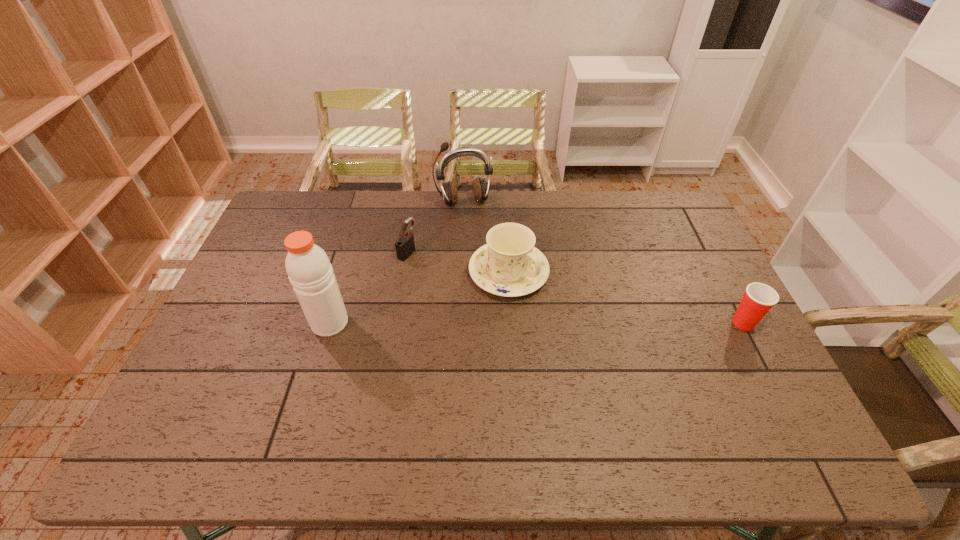
At what (x,y) coordinates should I click in order to perform the action: click on blank space at the far edge. Please return your answer as a coordinate pair (x, y). This screenshot has height=540, width=960. Looking at the image, I should click on (586, 222).

Where is `free region at the near edge`? The image size is (960, 540). free region at the near edge is located at coordinates (573, 387).

The image size is (960, 540). Find the location of `vacant area at the left edge of the desktop`. vacant area at the left edge of the desktop is located at coordinates (251, 379).

This screenshot has width=960, height=540. I want to click on vacant area at the right edge, so click(698, 246).

This screenshot has width=960, height=540. Find the location of `vacant space at the near right corner of the desktop`. vacant space at the near right corner of the desktop is located at coordinates (717, 401).

The width and height of the screenshot is (960, 540). I want to click on blank region between the rightmost object and the earphone, so click(x=604, y=262).

Identify the location of free point between the fourth object from right to left and the chinaware. Image resolution: width=960 pixels, height=540 pixels. coord(458,262).

Image resolution: width=960 pixels, height=540 pixels. In order to click on free space that is in between the leftmost object and the Dixie cup in this screenshot , I will do `click(537, 323)`.

Where is `free spot between the earphone and the leftmost object`? This screenshot has width=960, height=540. free spot between the earphone and the leftmost object is located at coordinates (397, 262).

You are a GUI agent. You are given a task and a screenshot of the screen. Output one action in this format:
    pyautogui.click(x=<x>, y=<y>)
    Task: Click on the vacant space that's between the second tallest object and the shaker
    
    Given the screenshot: What is the action you would take?
    pyautogui.click(x=397, y=262)